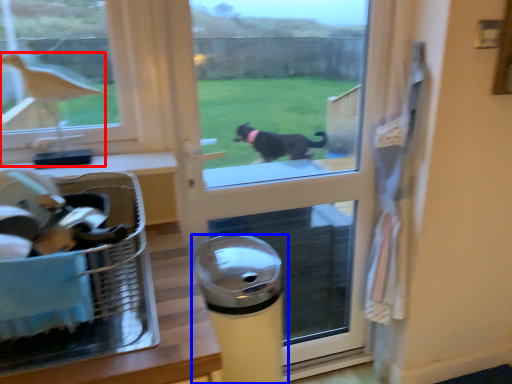
Question: Among these objects, which one is nearest to the camera, bird (highlighted by a red box) or waste container (highlighted by a blue box)?

Choices:
 (A) bird
 (B) waste container

Answer: (A)